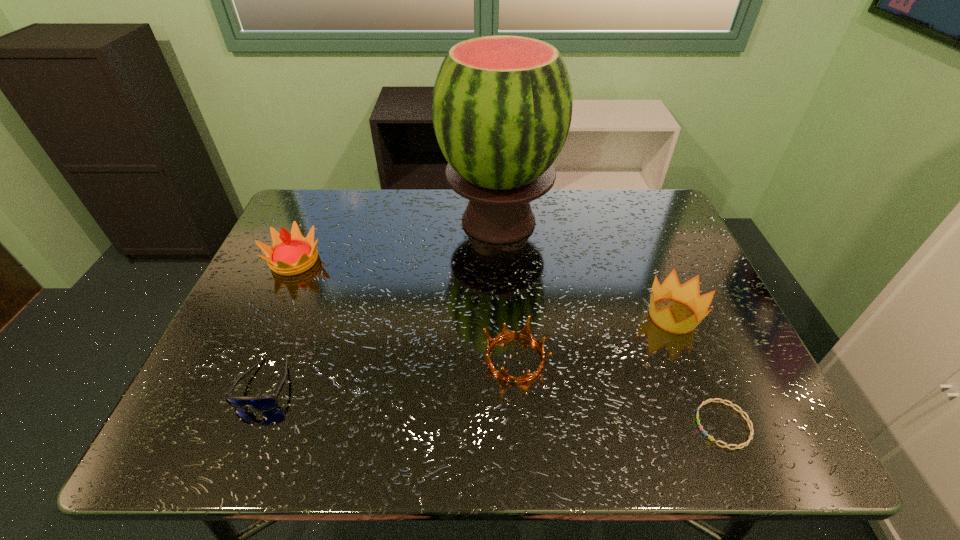
The image size is (960, 540). I want to click on the closest object to the second tallest object, so click(x=262, y=403).

Identify which object is the second closest to the bracelet. Please provide its 2D coordinates. Your answer should be formatted as a tuple, i.e. [(x, y)], where the tuple contains the x and y coordinates of a point satisfying the conditions above.

[(525, 333)]

This screenshot has height=540, width=960. What are the coordinates of `the closest crown to the second crown from right to left` in the screenshot? It's located at (688, 293).

Identify the location of the closest crown to the shortest crown. The height and width of the screenshot is (540, 960). (688, 293).